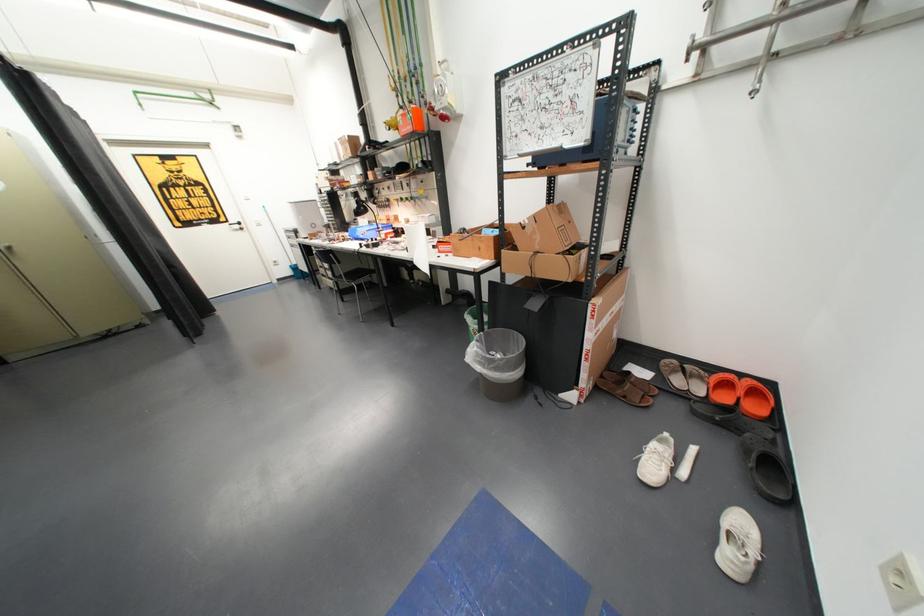
The image size is (924, 616). Find the location of `black clog`. black clog is located at coordinates (767, 468).